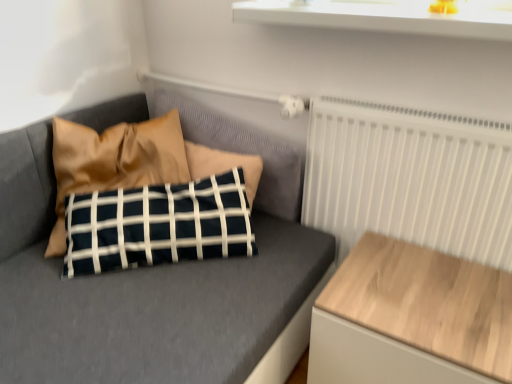
This screenshot has height=384, width=512. Find the location of `free space above wooden table at right (from a real-world perspective)`. free space above wooden table at right (from a real-world perspective) is located at coordinates (434, 292).